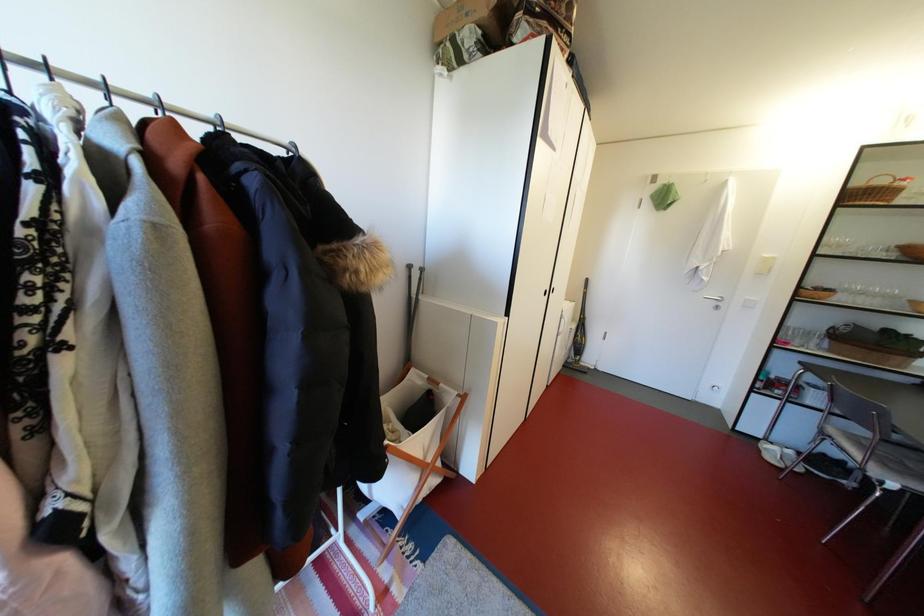
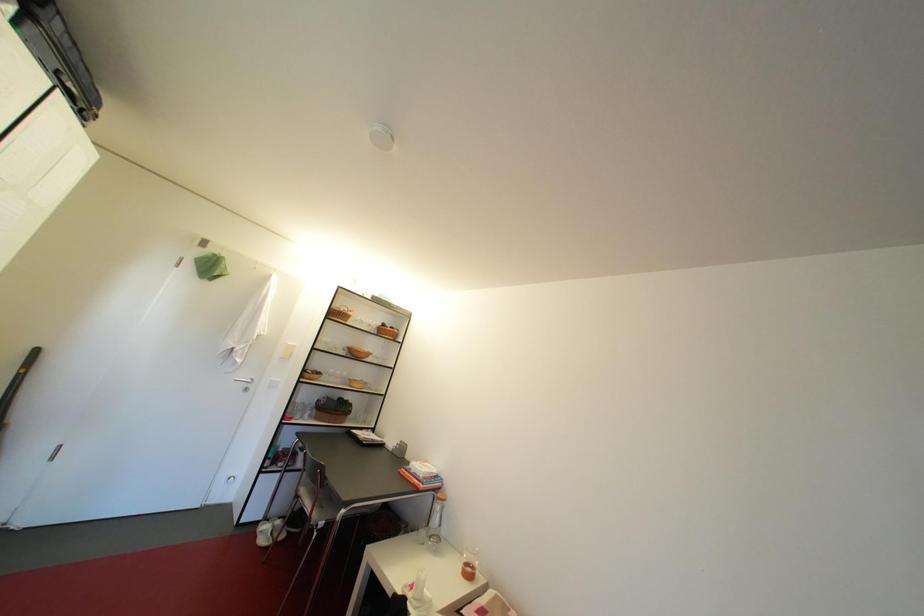
Question: The camera is either moving clockwise (left) or counter-clockwise (right) around the object. The first image is from the beginning of the video and the second image is from the end. Is the camera moving left or right when shooting the video?

Choices:
 (A) Left
 (B) Right

Answer: (A)